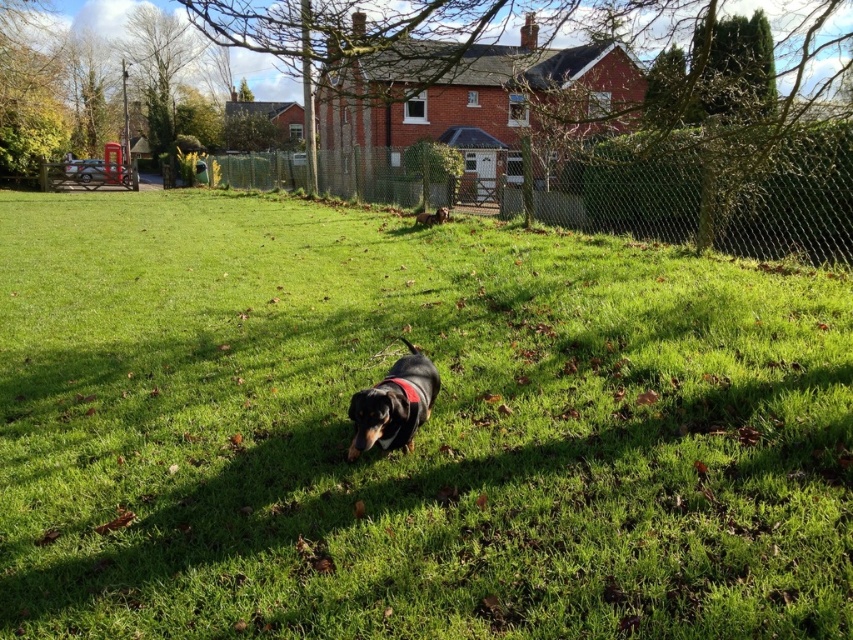
Question: Is green grassy at center below wire mesh fence at upper center?

Choices:
 (A) no
 (B) yes

Answer: (B)

Question: Which of the following is the closest to the observer?

Choices:
 (A) (294, 180)
 (B) (549, 381)

Answer: (B)

Question: Which object is the closest to the black smooth dachshund at center?

Choices:
 (A) green grassy at center
 (B) wire mesh fence at upper center
 (C) black glossy dog at center

Answer: (A)

Question: Does wire mesh fence at upper center appear on the right side of black glossy dog at center?

Choices:
 (A) no
 (B) yes

Answer: (A)

Question: Is wire mesh fence at upper center behind black smooth dachshund at center?

Choices:
 (A) no
 (B) yes

Answer: (B)

Question: Estimate the real-world distances between objects in this image. Which object is closer to the black glossy dog at center?

Choices:
 (A) green grassy at center
 (B) black smooth dachshund at center

Answer: (A)